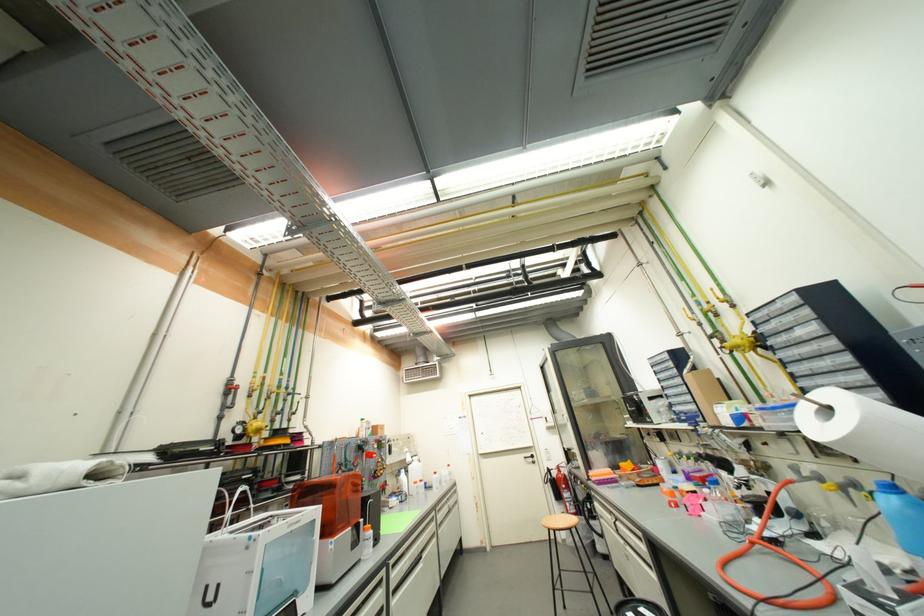
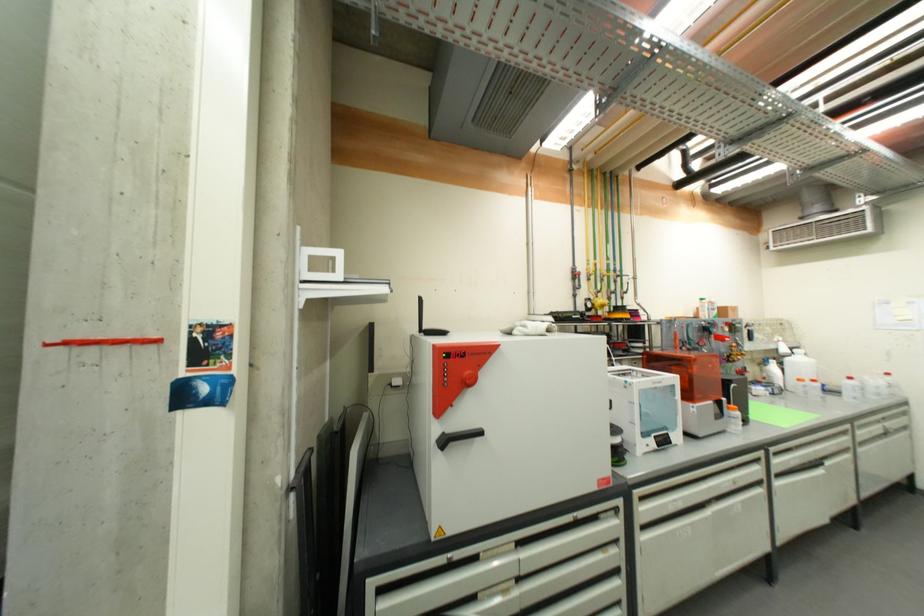
In the second image, find the point that corresponds to (373,532) in the first image.

(739, 411)